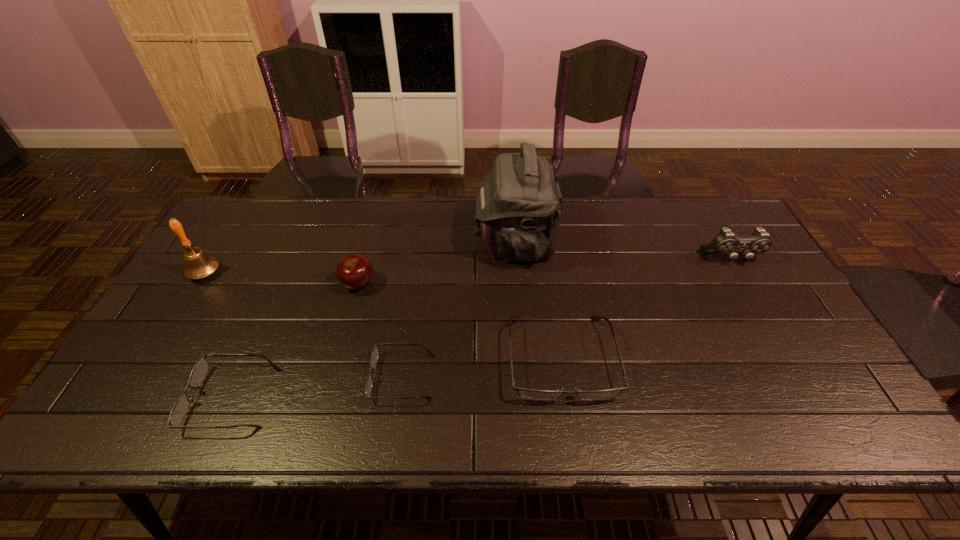
This screenshot has width=960, height=540. Identify the location of vacant space positioned 0.140m on the surface of the rightmost object with buttons. (756, 303).

The height and width of the screenshot is (540, 960). In order to click on vacant space located 0.380m on the back of the fifth object from right to left in this screenshot , I will do `click(381, 197)`.

Identify the location of vacant space located 0.330m on the front of the sixth shortest object. The width and height of the screenshot is (960, 540). (137, 386).

This screenshot has width=960, height=540. I want to click on object that is positioned at the far edge, so click(519, 207).

You are a GUI agent. You are given a task and a screenshot of the screen. Output one action in this format:
    pyautogui.click(x=<x>, y=<y>)
    Task: Click on the object at the left edge
    This screenshot has width=960, height=540.
    Given the screenshot: What is the action you would take?
    pyautogui.click(x=198, y=265)

At what (x,y) coordinates should I click in order to perform the action: click on object present at the right edge. Please return your answer as a coordinate pair (x, y). Image resolution: width=960 pixels, height=540 pixels. Looking at the image, I should click on (725, 242).

Locate an element on the screen. Image resolution: width=960 pixels, height=540 pixels. vacant space at the far edge of the desktop is located at coordinates (475, 207).

Locate an element on the screen. This screenshot has height=540, width=960. vacant space at the near edge is located at coordinates (497, 392).

I want to click on free spot at the left edge of the desktop, so [186, 279].

You are a GUI agent. You are given a task and a screenshot of the screen. Output one action in this format:
    pyautogui.click(x=<x>, y=<y>)
    Task: Click on the free space at the right edge of the desktop
    
    Given the screenshot: What is the action you would take?
    tap(762, 273)